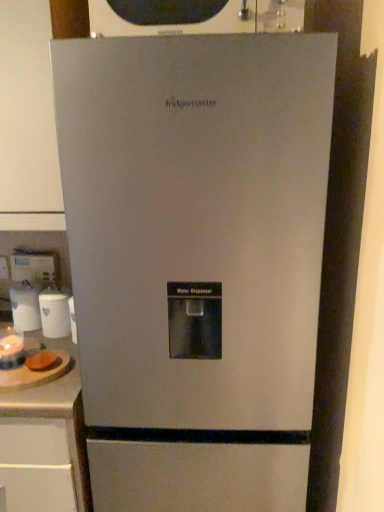
This screenshot has height=512, width=384. I want to click on vacant area in front of brown bread at left, so click(35, 390).